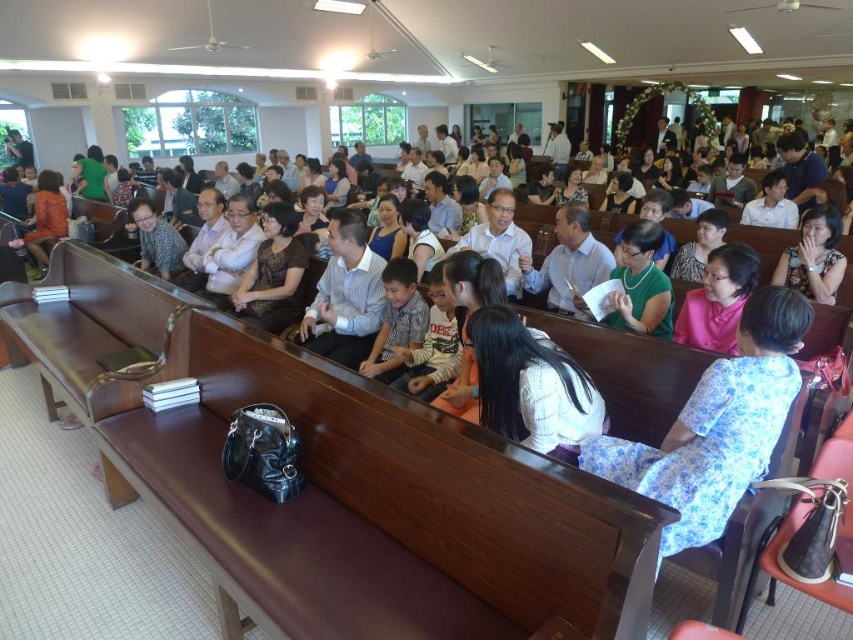
You are organizing a photo shoot in this hall and need to place two props. The first prop is a small decorative pillow that must be placed near the blue shirt at center. The second prop is a large standing lamp that needs to be placed near the matte black jacket at center. Given the space each occupies, which prop should you place first to ensure they both fit comfortably?

The blue shirt at center occupies less space than the matte black jacket at center, so you should place the large standing lamp near the matte black jacket at center first to accommodate its larger size, then place the small decorative pillow near the blue shirt at center.

You are standing at the entrance of the hall and see two people in the center area wearing a white sweater at center and a blue shirt at center. Which one is closer to the floor?

The white sweater at center is below the blue shirt at center, so the white sweater at center is closer to the floor.

You are an event planner trying to seat a new guest. You see the blue shirt at center and the matte black jacket at center. Which one is sitting closer to the front of the hall?

The blue shirt at center is located below matte black jacket at center, so the blue shirt at center is sitting closer to the front of the hall.